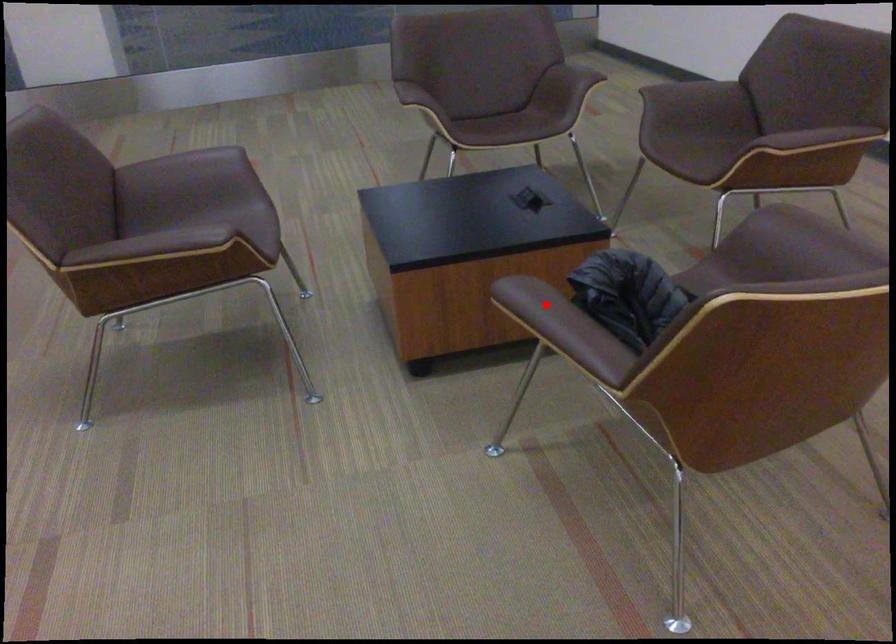
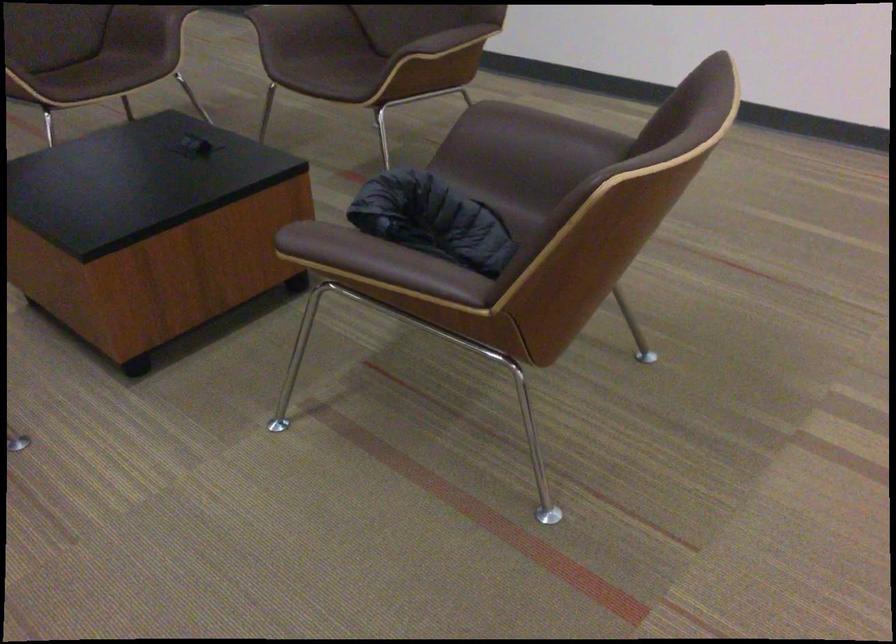
Question: I am providing you with two images of the same scene from different viewpoints. A red point is shown in image1. For the corresponding object point in image2, is it positioned nearer or farther from the camera?

Choices:
 (A) Nearer
 (B) Farther

Answer: (A)